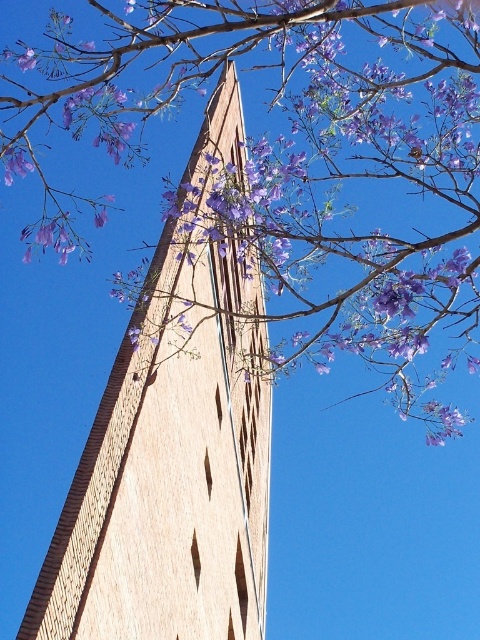
Between point (295, 28) and point (182, 323), which one is positioned in front?

Point (182, 323) is in front.

Between purple leafy branches at upper center and light brown brick tower at center, which one appears on the right side from the viewer's perspective?

From the viewer's perspective, purple leafy branches at upper center appears more on the right side.

Is point (393, 291) in front of point (113, 497)?

No, it is behind (113, 497).

I want to click on purple leafy branches at upper center, so click(x=294, y=156).